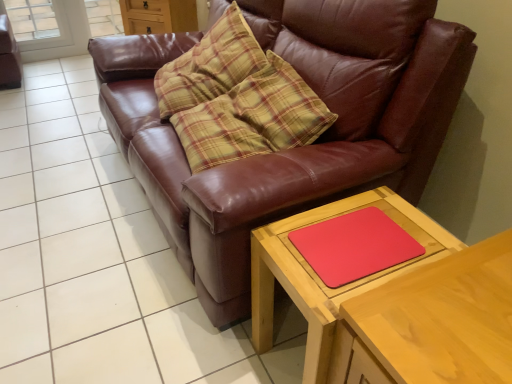
What are the coordinates of `vacant space situated above wooden table at lower right, placed as the second table when sorted from left to right (from a real-world perspective)` in the screenshot? It's located at (449, 307).